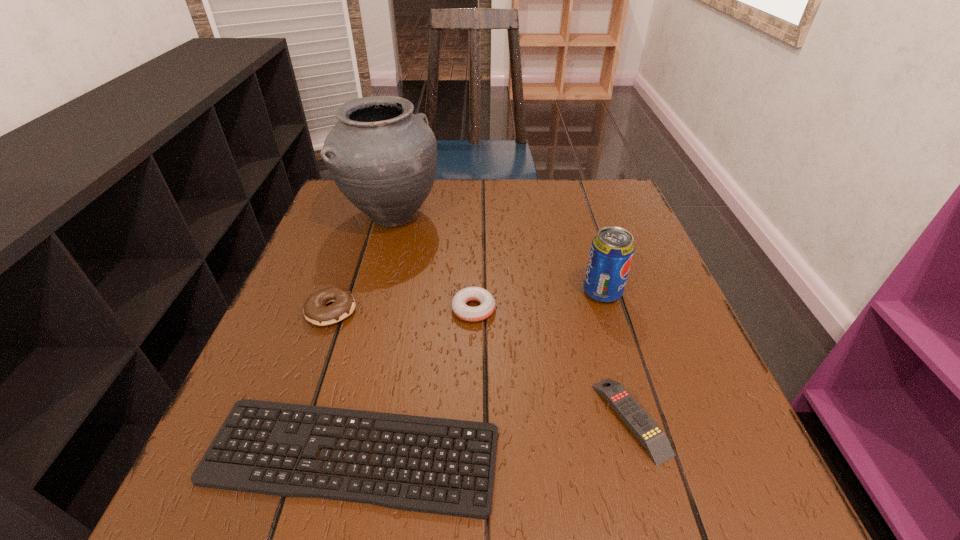
Locate an element on the screen. This screenshot has height=540, width=960. computer keyboard that is at the left edge is located at coordinates (208, 474).

The height and width of the screenshot is (540, 960). I want to click on soda at the right edge, so click(612, 249).

You are a GUI agent. You are given a task and a screenshot of the screen. Output one action in this format:
    pyautogui.click(x=<x>, y=<y>)
    Task: Click on the remote control positioned at the right edge
    This screenshot has height=540, width=960.
    Given the screenshot: What is the action you would take?
    pyautogui.click(x=651, y=436)

Where is `object that is at the far left corner`? The height and width of the screenshot is (540, 960). object that is at the far left corner is located at coordinates (383, 158).

Locate an element on the screen. The image size is (960, 540). object located in the near left corner section of the desktop is located at coordinates (208, 474).

This screenshot has height=540, width=960. In order to click on object located in the near right corner section of the desktop in this screenshot , I will do `click(651, 436)`.

The height and width of the screenshot is (540, 960). In the image, there is a desktop. Find the location of `vacant region at the far edge`. vacant region at the far edge is located at coordinates (548, 180).

Locate an element on the screen. The image size is (960, 540). vacant space at the near edge of the desktop is located at coordinates (617, 467).

Locate an element on the screen. blank space at the left edge of the desktop is located at coordinates (359, 311).

Find the location of a particular element. free space at the right edge of the desktop is located at coordinates (623, 332).